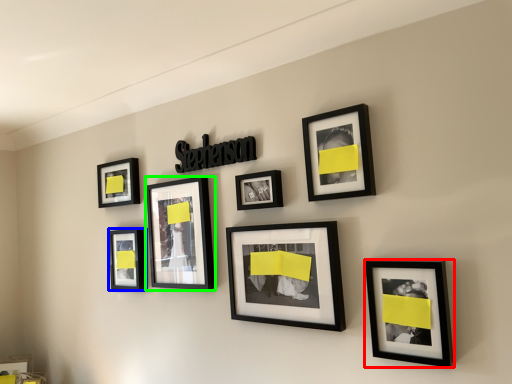
Question: Which object is the closest to the picture frame (highlighted by a red box)? Choose among these: picture frame (highlighted by a blue box) or picture frame (highlighted by a green box).

Choices:
 (A) picture frame
 (B) picture frame

Answer: (B)